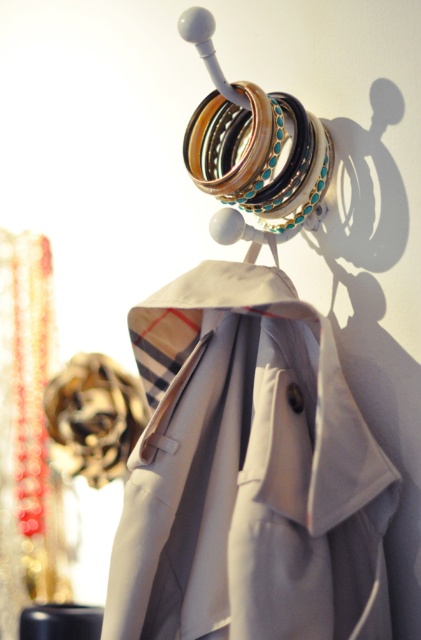
Can you confirm if light beige fabric coat at center is bigger than shiny gold bangles at center?

Yes.

Is light beige fabric coat at center in front of shiny gold bangles at center?

That is True.

Who is more distant from viewer, (x=253, y=449) or (x=293, y=173)?

Positioned behind is point (x=293, y=173).

At what (x,y) coordinates should I click in order to perform the action: click on light beige fabric coat at center. Please return your answer as a coordinate pair (x, y). The height and width of the screenshot is (640, 421). Looking at the image, I should click on (247, 472).